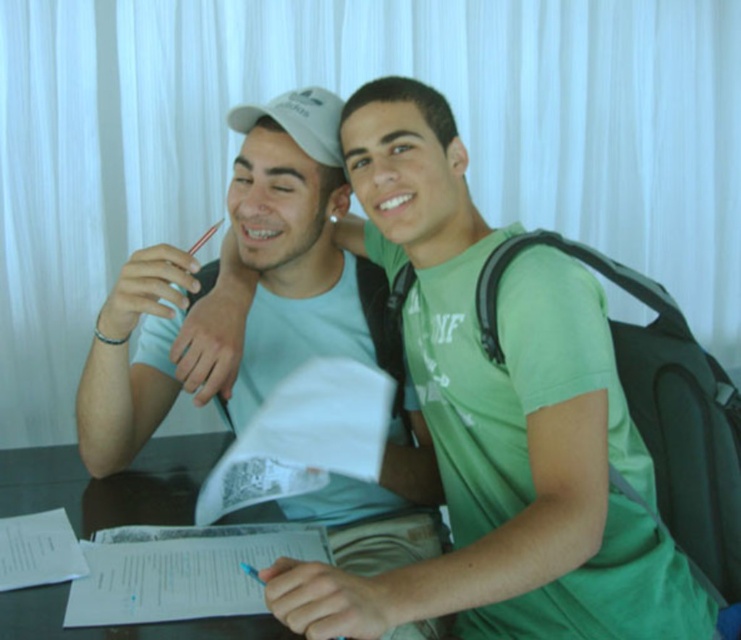
Who is positioned more to the left, matte white cap at upper left or transparent glass table at center?

transparent glass table at center is more to the left.

Which of these two, matte white cap at upper left or transparent glass table at center, stands taller?

Standing taller between the two is matte white cap at upper left.

The height and width of the screenshot is (640, 741). In order to click on matte white cap at upper left in this screenshot , I will do `click(325, 324)`.

Identify the location of matte white cap at upper left. point(325,324).